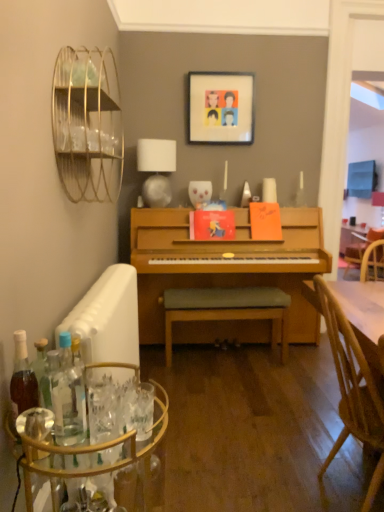
Question: Should I look upward or downward to see light green fabric cushioned bench at center?

Choices:
 (A) down
 (B) up

Answer: (A)

Question: Is white fabric lampshade at upper center oriented away from light green fabric cushioned bench at center?

Choices:
 (A) yes
 (B) no

Answer: (B)

Question: Does white fabric lampshade at upper center have a larger size compared to light green fabric cushioned bench at center?

Choices:
 (A) no
 (B) yes

Answer: (A)

Question: Considering the relative sizes of white fabric lampshade at upper center and light green fabric cushioned bench at center in the image provided, is white fabric lampshade at upper center thinner than light green fabric cushioned bench at center?

Choices:
 (A) no
 (B) yes

Answer: (B)

Question: Does white fabric lampshade at upper center have a greater width compared to light green fabric cushioned bench at center?

Choices:
 (A) no
 (B) yes

Answer: (A)

Question: Would you say white fabric lampshade at upper center contains light green fabric cushioned bench at center?

Choices:
 (A) yes
 (B) no

Answer: (B)

Question: Is white fabric lampshade at upper center behind light green fabric cushioned bench at center?

Choices:
 (A) no
 (B) yes

Answer: (B)

Question: From the image's perspective, is matte plastic picture frame at upper center under clear glass bottle at lower left, which ranks as the second bottle in left-to-right order?

Choices:
 (A) no
 (B) yes

Answer: (A)

Question: From the image's perspective, would you say matte plastic picture frame at upper center is positioned over clear glass bottle at lower left, which ranks as the first bottle in right-to-left order?

Choices:
 (A) yes
 (B) no

Answer: (A)

Question: Is clear glass bottle at lower left, which ranks as the first bottle in right-to-left order, completely or partially inside matte plastic picture frame at upper center?

Choices:
 (A) no
 (B) yes

Answer: (A)

Question: Is matte plastic picture frame at upper center in contact with clear glass bottle at lower left, which ranks as the first bottle in right-to-left order?

Choices:
 (A) no
 (B) yes

Answer: (A)

Question: From a real-world perspective, is matte plastic picture frame at upper center under clear glass bottle at lower left, which ranks as the first bottle in right-to-left order?

Choices:
 (A) no
 (B) yes

Answer: (A)

Question: Can you confirm if matte plastic picture frame at upper center is bigger than clear glass bottle at lower left, which ranks as the first bottle in right-to-left order?

Choices:
 (A) yes
 (B) no

Answer: (A)

Question: Can you confirm if clear glass bottle at lower left, which ranks as the second bottle in left-to-right order, is thinner than light green fabric cushioned bench at center?

Choices:
 (A) no
 (B) yes

Answer: (B)